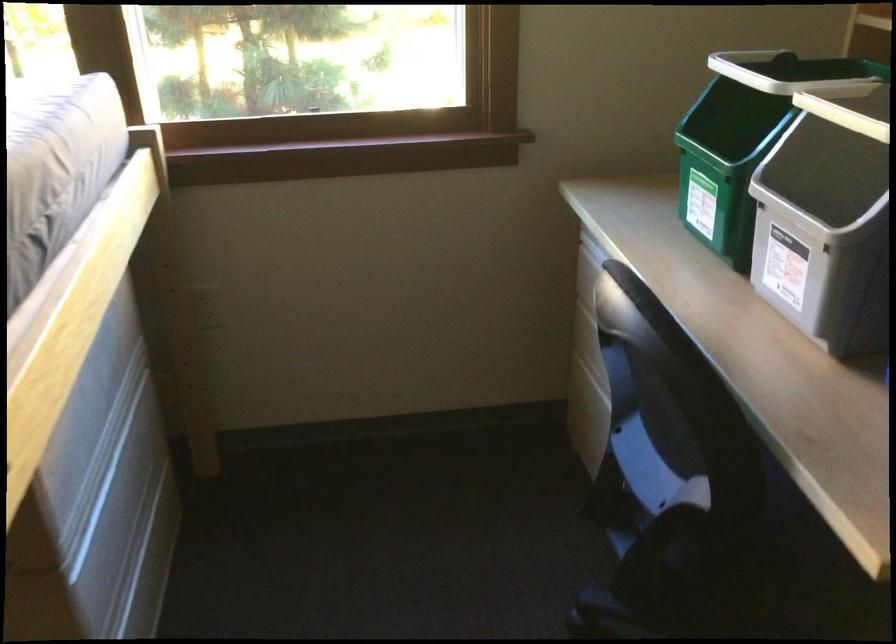
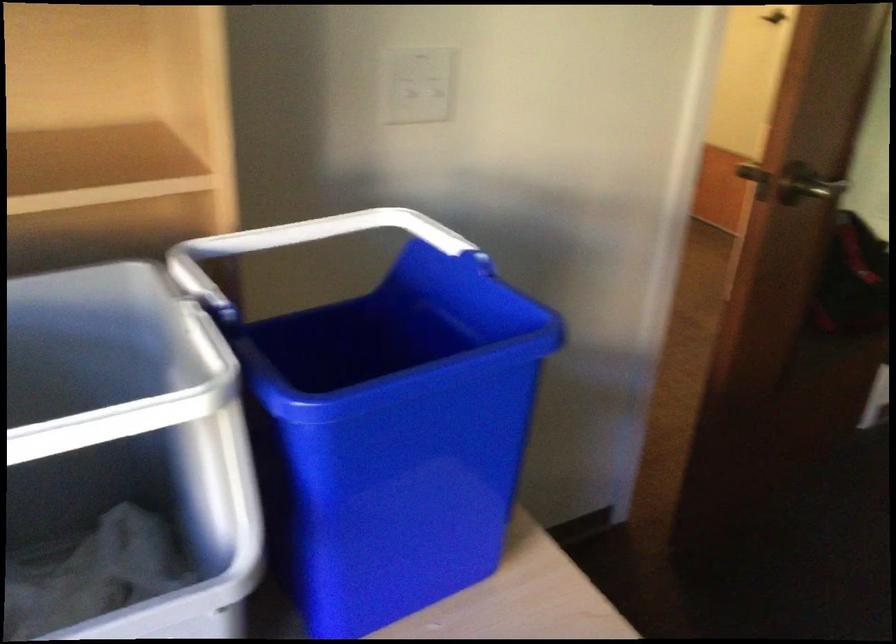
First-person continuous shooting, in which direction is the camera rotating?

The camera's rotation is toward right-down.